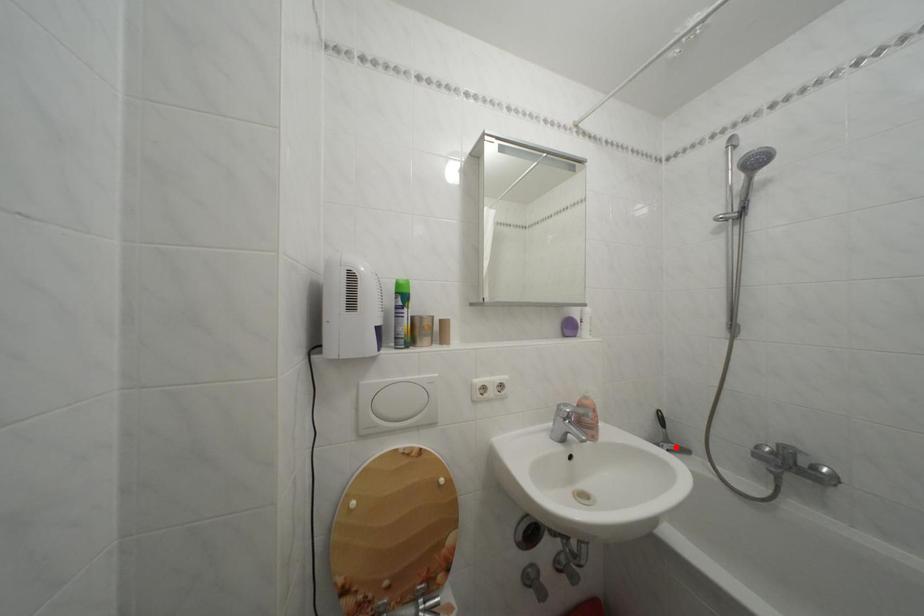
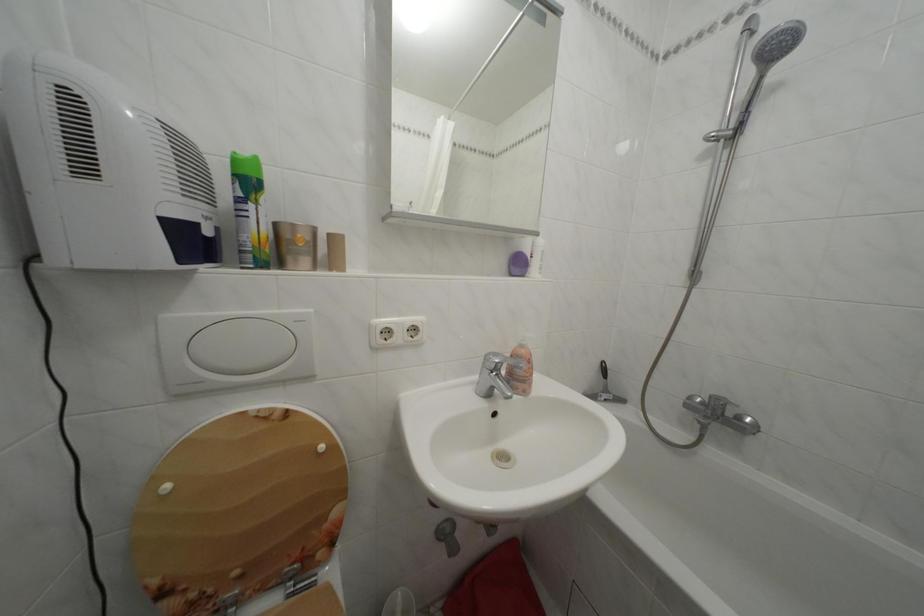
Question: I am providing you with two images of the same scene from different viewpoints. Given a red point in image1, look at the same physical point in image2. Is it:

Choices:
 (A) Closer to the viewpoint
 (B) Farther from the viewpoint

Answer: (B)